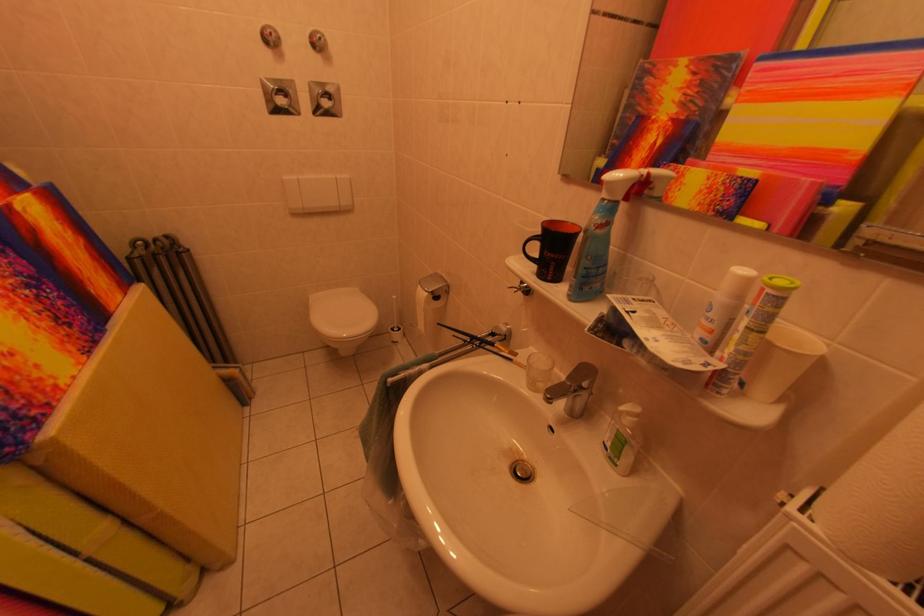
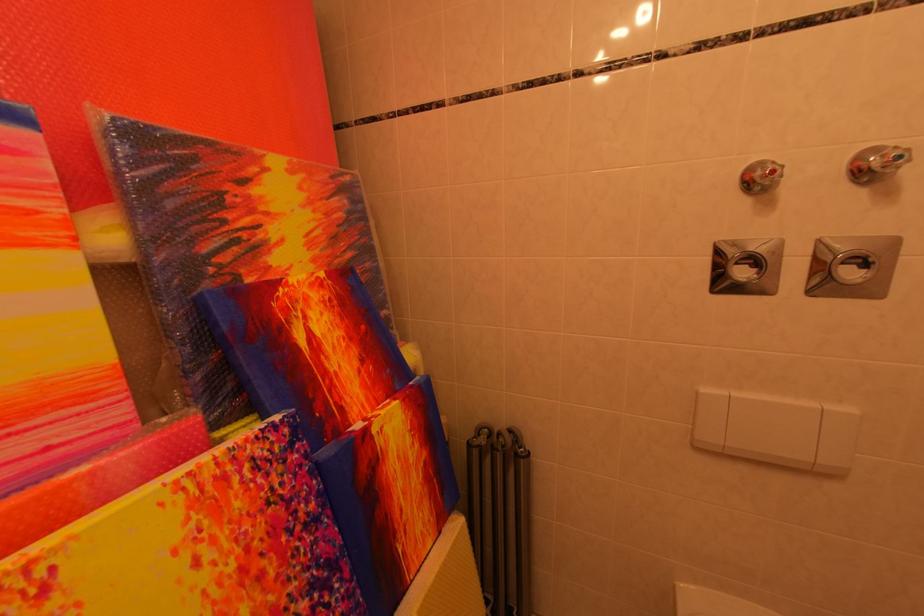
Where in the second image is the point corresponding to (327,44) from the first image?

(907, 161)